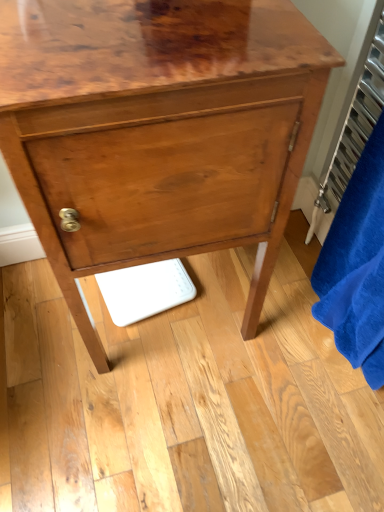
Question: Is there a large distance between glossy wood chest of drawers at center and metallic silver radiator at right?

Choices:
 (A) no
 (B) yes

Answer: (A)

Question: Considering the relative sizes of glossy wood chest of drawers at center and metallic silver radiator at right in the image provided, is glossy wood chest of drawers at center taller than metallic silver radiator at right?

Choices:
 (A) yes
 (B) no

Answer: (A)

Question: Is the depth of glossy wood chest of drawers at center greater than that of metallic silver radiator at right?

Choices:
 (A) no
 (B) yes

Answer: (A)

Question: Is glossy wood chest of drawers at center wider than metallic silver radiator at right?

Choices:
 (A) yes
 (B) no

Answer: (A)

Question: From the image's perspective, is glossy wood chest of drawers at center located beneath metallic silver radiator at right?

Choices:
 (A) yes
 (B) no

Answer: (A)

Question: Does glossy wood chest of drawers at center have a larger size compared to metallic silver radiator at right?

Choices:
 (A) yes
 (B) no

Answer: (A)

Question: Can you confirm if metallic silver radiator at right is positioned to the left of glossy wood chest of drawers at center?

Choices:
 (A) yes
 (B) no

Answer: (B)

Question: Is the depth of metallic silver radiator at right greater than that of glossy wood chest of drawers at center?

Choices:
 (A) yes
 (B) no

Answer: (A)

Question: From the image's perspective, is metallic silver radiator at right beneath glossy wood chest of drawers at center?

Choices:
 (A) yes
 (B) no

Answer: (B)

Question: Is metallic silver radiator at right looking in the opposite direction of glossy wood chest of drawers at center?

Choices:
 (A) no
 (B) yes

Answer: (B)

Question: Would you say glossy wood chest of drawers at center is part of metallic silver radiator at right's contents?

Choices:
 (A) yes
 (B) no

Answer: (B)

Question: Would you say metallic silver radiator at right is a long distance from glossy wood chest of drawers at center?

Choices:
 (A) yes
 (B) no

Answer: (B)

Question: From a real-world perspective, is blue plush bath towel at right positioned under metallic silver radiator at right based on gravity?

Choices:
 (A) yes
 (B) no

Answer: (A)